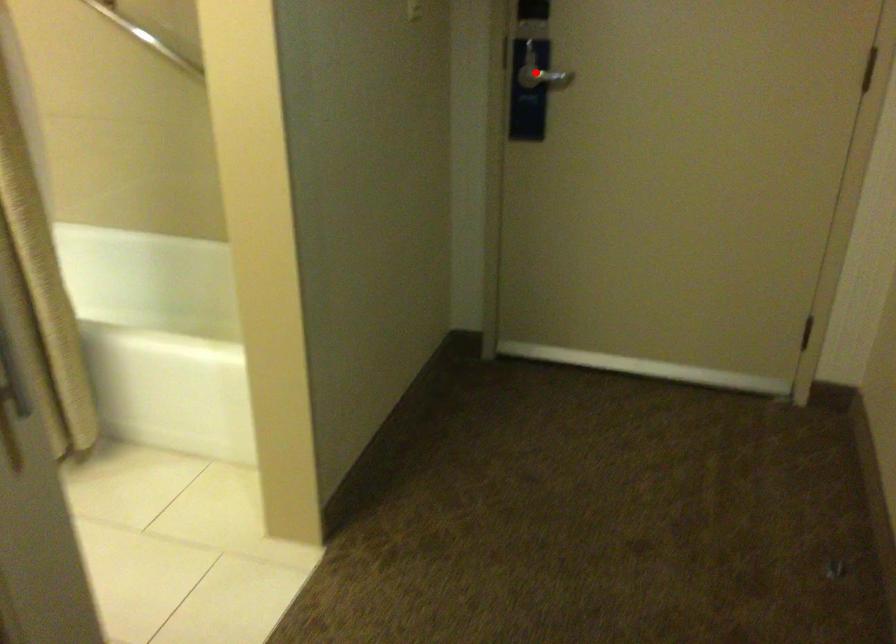
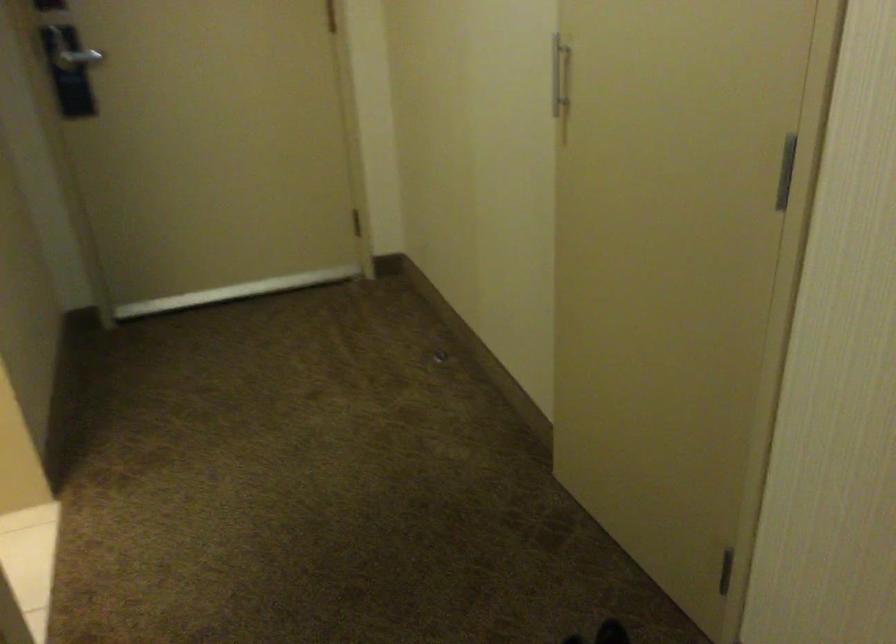
Locate, in the second image, the point that corresponds to the highlighted location in the first image.

(73, 53)